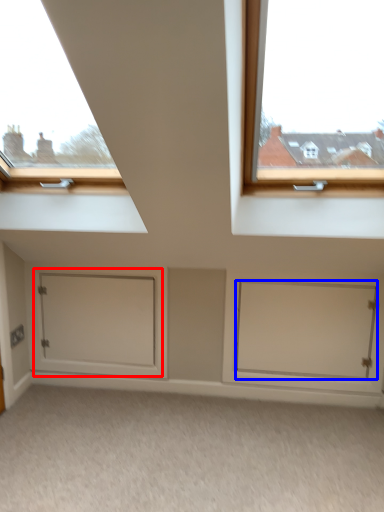
Question: Among these objects, which one is nearest to the camera, door (highlighted by a red box) or door (highlighted by a blue box)?

Choices:
 (A) door
 (B) door

Answer: (B)